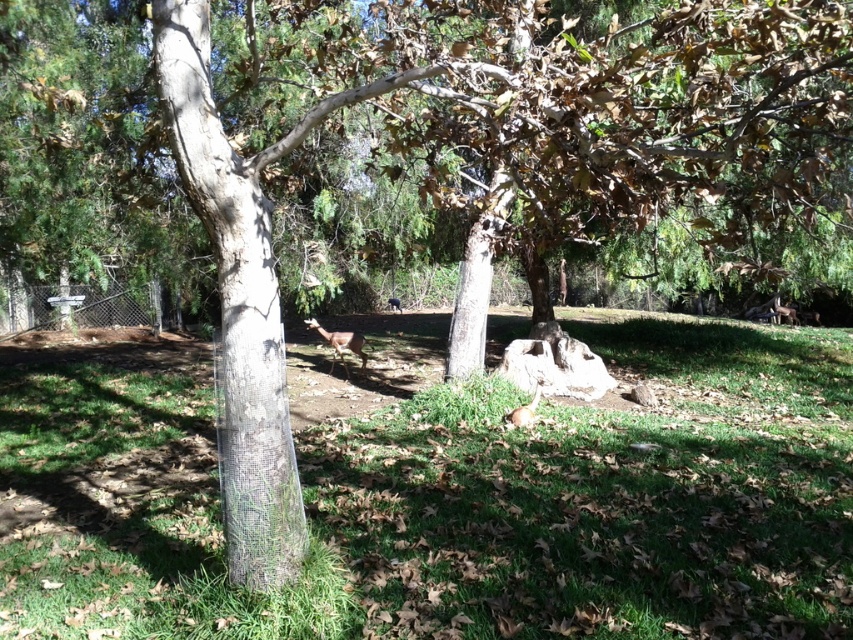
Does green grassy at center appear on the left side of clear plastic tree trunk at left?

In fact, green grassy at center is to the right of clear plastic tree trunk at left.

You are a GUI agent. You are given a task and a screenshot of the screen. Output one action in this format:
    pyautogui.click(x=<x>, y=<y>)
    Task: Click on the green grassy at center
    Image resolution: width=853 pixels, height=640 pixels.
    Given the screenshot: What is the action you would take?
    point(444,492)

Between green grassy at center and brown furry deer at lower right, which one appears on the right side from the viewer's perspective?

brown furry deer at lower right is more to the right.

Locate an element on the screen. green grassy at center is located at coordinates (444, 492).

Where is `green grassy at center`? This screenshot has width=853, height=640. green grassy at center is located at coordinates (444, 492).

Does brown furry deer at center come behind brown fur deer at center?

No, brown furry deer at center is in front of brown fur deer at center.

Looking at this image, between brown furry deer at center and brown fur deer at center, which one is positioned lower?

brown furry deer at center is below.

The height and width of the screenshot is (640, 853). I want to click on brown furry deer at center, so click(x=341, y=342).